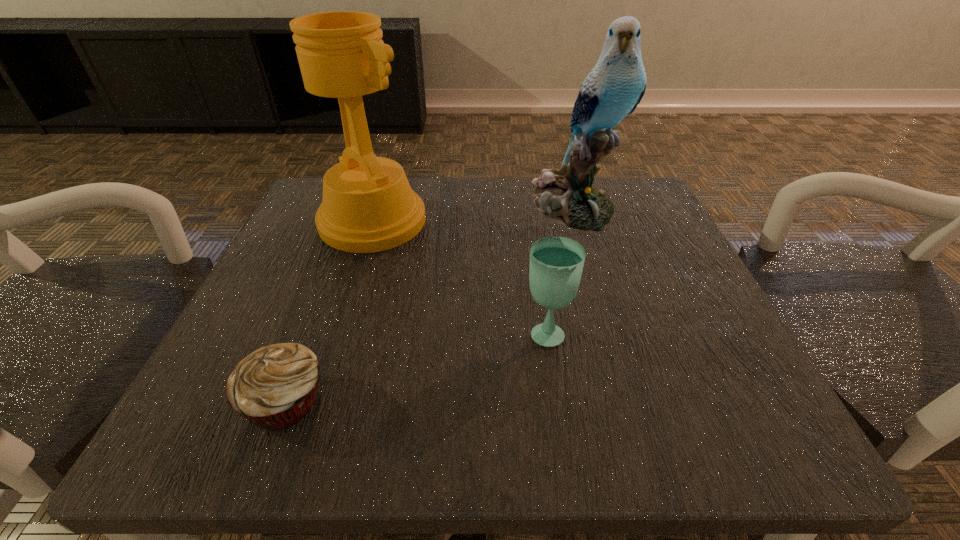
Identify the location of parakeet located in the far edge section of the desktop. This screenshot has height=540, width=960. (615, 86).

Find the location of `award at the far edge`. award at the far edge is located at coordinates (368, 206).

This screenshot has height=540, width=960. In order to click on object located at the near edge in this screenshot , I will do `click(274, 387)`.

Where is `award that is positioned at the left edge`? award that is positioned at the left edge is located at coordinates (368, 206).

Where is `muffin located in the left edge section of the desktop`? This screenshot has width=960, height=540. muffin located in the left edge section of the desktop is located at coordinates (x=274, y=387).

At what (x,y) coordinates should I click in order to perform the action: click on object positioned at the right edge. Please return your answer as a coordinate pair (x, y). Looking at the image, I should click on (615, 86).

I want to click on object located in the far left corner section of the desktop, so click(x=368, y=206).

Where is `object situated at the near left corner`? The height and width of the screenshot is (540, 960). object situated at the near left corner is located at coordinates pos(274,387).

I want to click on object that is at the far right corner, so click(x=615, y=86).

In the image, there is a desktop. Where is `vacant space at the far edge`? This screenshot has width=960, height=540. vacant space at the far edge is located at coordinates (474, 201).